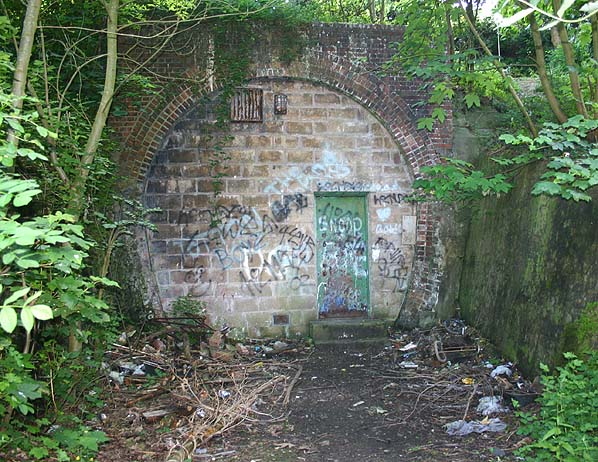
Find the location of `top right corner of doorway`. top right corner of doorway is located at coordinates (369, 193).